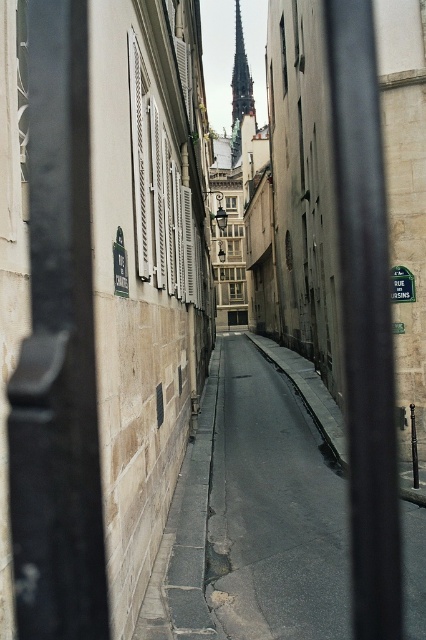
Question: Does smooth asphalt road at center come behind smooth gray stone spire at upper center?

Choices:
 (A) no
 (B) yes

Answer: (A)

Question: From the image, what is the correct spatial relationship of smooth asphalt road at center in relation to green plastic street sign at center?

Choices:
 (A) below
 (B) above

Answer: (A)

Question: Which point is closer to the camera taking this photo?

Choices:
 (A) (238, 52)
 (B) (322, 548)
 (C) (391, 278)

Answer: (B)

Question: Which point appears closest to the camera in this image?

Choices:
 (A) (262, 397)
 (B) (400, 266)
 (C) (247, 77)

Answer: (B)

Question: Is smooth asphalt road at center below smooth gray stone spire at upper center?

Choices:
 (A) no
 (B) yes

Answer: (B)

Question: Estimate the real-world distances between objects in this image. Which object is closer to the smooth gray stone spire at upper center?

Choices:
 (A) green plastic street sign at center
 (B) smooth asphalt road at center

Answer: (A)